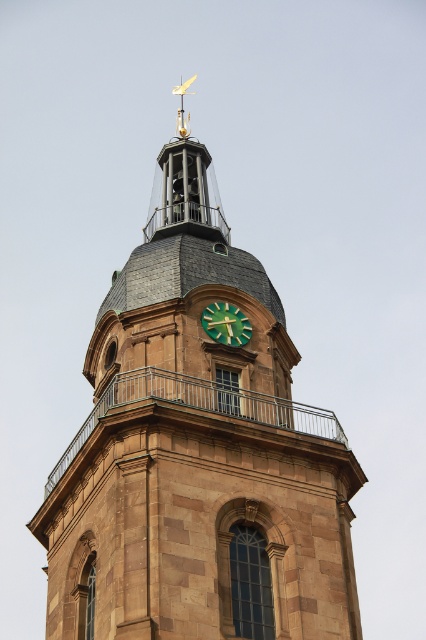
You are standing in front of the brown stone clock tower at center and the green matte clock at center. Which object is located higher up?

The brown stone clock tower at center is positioned over the green matte clock at center, so it is higher up.

You are standing in front of the historic clock tower and want to determine which of the two points, point (256,513) or point (227,304), is closer to you. Based on the clock tower structure described, which point is nearer?

Point (256,513) is closer to the viewer than point (227,304).